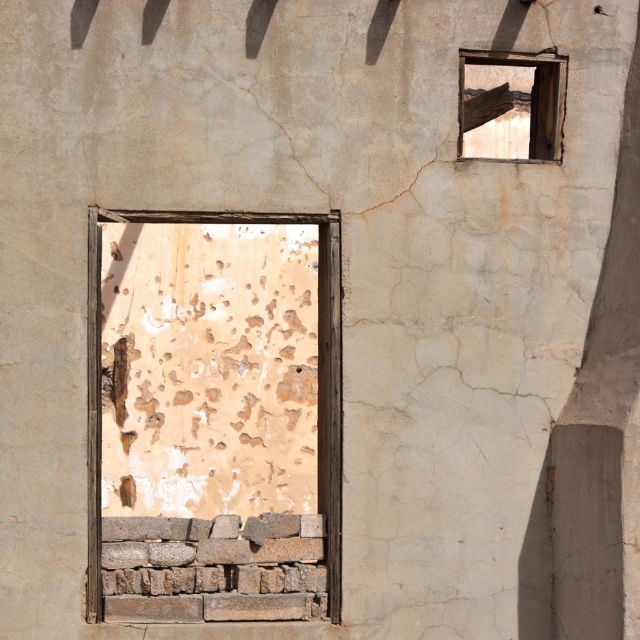
Which of these two, brown wooden window frame at center or wooden frame at upper right, stands shorter?

Standing shorter between the two is brown wooden window frame at center.

Looking at this image, is brown wooden window frame at center positioned before wooden frame at upper right?

No, brown wooden window frame at center is further to the viewer.

Who is more forward, (208, 344) or (532, 140)?

Positioned in front is point (532, 140).

At what (x,y) coordinates should I click in order to perform the action: click on brown wooden window frame at center. Please return your answer as a coordinate pair (x, y). Image resolution: width=640 pixels, height=640 pixels. Looking at the image, I should click on (212, 417).